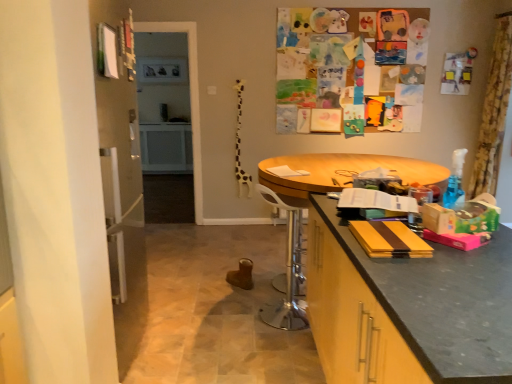
Question: Should I look upward or downward to see yellow floral fabric curtain at upper right?

Choices:
 (A) down
 (B) up

Answer: (B)

Question: From a real-world perspective, is white plastic swivel chair at center positioned under yellow floral fabric curtain at upper right based on gravity?

Choices:
 (A) no
 (B) yes

Answer: (B)

Question: From a real-world perspective, is white plastic swivel chair at center on top of yellow floral fabric curtain at upper right?

Choices:
 (A) no
 (B) yes

Answer: (A)

Question: Considering the relative positions of white plastic swivel chair at center and yellow floral fabric curtain at upper right in the image provided, is white plastic swivel chair at center in front of yellow floral fabric curtain at upper right?

Choices:
 (A) yes
 (B) no

Answer: (A)

Question: From the image's perspective, is white plastic swivel chair at center over yellow floral fabric curtain at upper right?

Choices:
 (A) no
 (B) yes

Answer: (A)

Question: Is white plastic swivel chair at center bigger than yellow floral fabric curtain at upper right?

Choices:
 (A) yes
 (B) no

Answer: (B)

Question: Is white plastic swivel chair at center taller than yellow floral fabric curtain at upper right?

Choices:
 (A) no
 (B) yes

Answer: (A)

Question: Can you confirm if white plastic swivel chair at center is bigger than wooden round table at center?

Choices:
 (A) yes
 (B) no

Answer: (B)

Question: Is white plastic swivel chair at center at the right side of wooden round table at center?

Choices:
 (A) yes
 (B) no

Answer: (B)

Question: From the image's perspective, is white plastic swivel chair at center located beneath wooden round table at center?

Choices:
 (A) no
 (B) yes

Answer: (B)

Question: Can you confirm if white plastic swivel chair at center is shorter than wooden round table at center?

Choices:
 (A) no
 (B) yes

Answer: (B)

Question: Is wooden round table at center located within white plastic swivel chair at center?

Choices:
 (A) no
 (B) yes

Answer: (A)

Question: Can you see white plastic swivel chair at center touching wooden round table at center?

Choices:
 (A) yes
 (B) no

Answer: (B)

Question: From the image's perspective, does yellow floral fabric curtain at upper right appear lower than wooden round table at center?

Choices:
 (A) yes
 (B) no

Answer: (B)